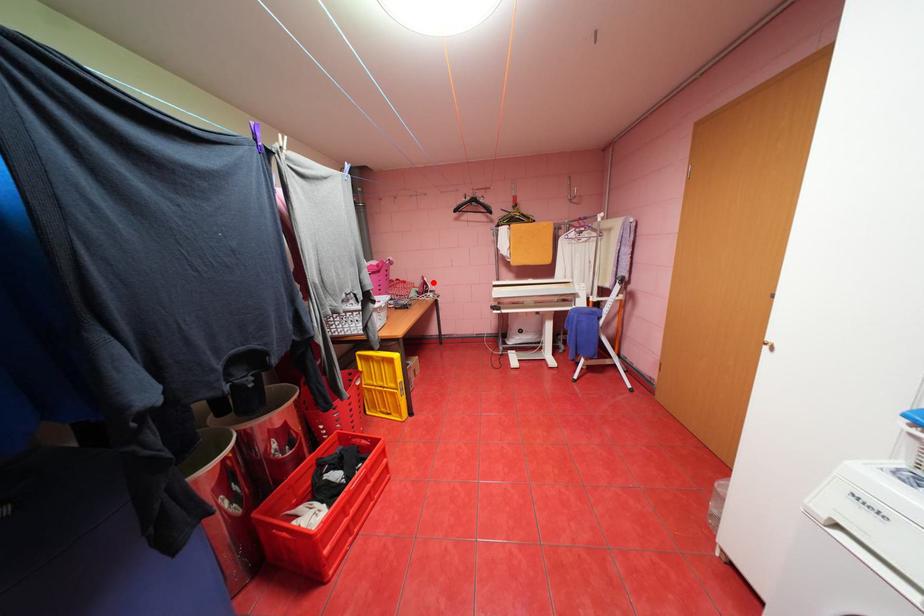
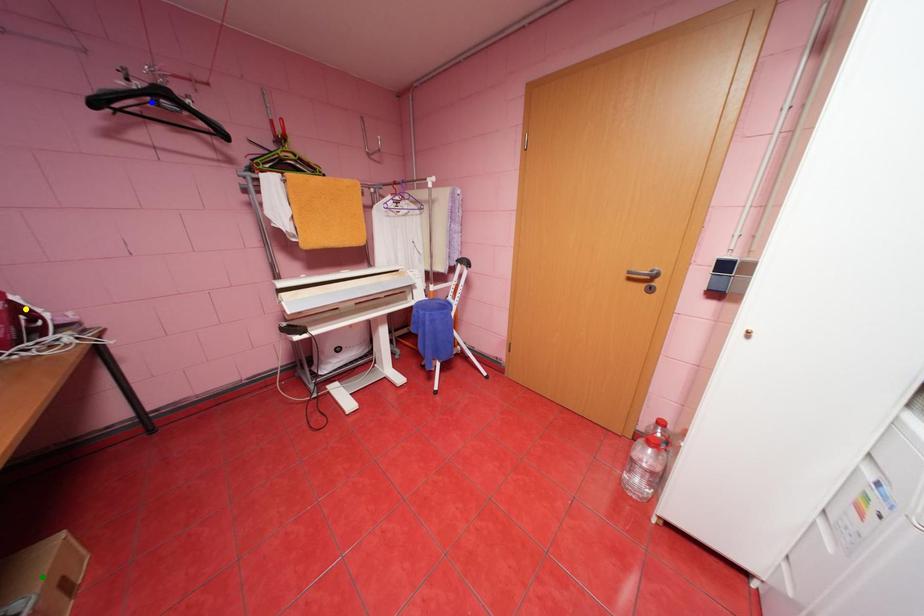
Question: I am providing you with two images of the same scene from different viewpoints. A red point is marked on the first image. You are given multiple points on the second image. Can you choose the point in image 2 that corresponds to the point in image 1?

Choices:
 (A) yellow point
 (B) blue point
 (C) green point

Answer: (A)